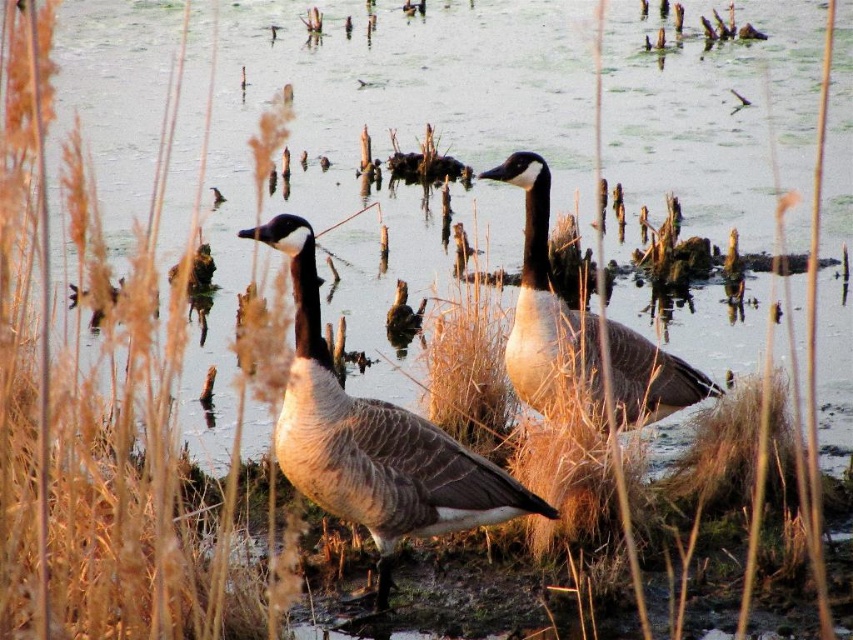
Does point (30, 122) come in front of point (560, 326)?

That is True.

Does brown grass at left have a greater width compared to white-feathered duck at center?

Correct, the width of brown grass at left exceeds that of white-feathered duck at center.

You are a GUI agent. You are given a task and a screenshot of the screen. Output one action in this format:
    pyautogui.click(x=<x>, y=<y>)
    Task: Click on the brown grass at left
    
    Given the screenshot: What is the action you would take?
    pyautogui.click(x=96, y=403)

Can you confirm if matte gray duck at center is smaller than white-feathered duck at center?

No.

Is matte gray duck at center above white-feathered duck at center?

Actually, matte gray duck at center is below white-feathered duck at center.

Where is `matte gray duck at center`? The width and height of the screenshot is (853, 640). matte gray duck at center is located at coordinates click(373, 438).

Who is taller, brown grass at left or matte gray duck at center?

Standing taller between the two is brown grass at left.

Where is `brown grass at left`? Image resolution: width=853 pixels, height=640 pixels. brown grass at left is located at coordinates (96, 403).